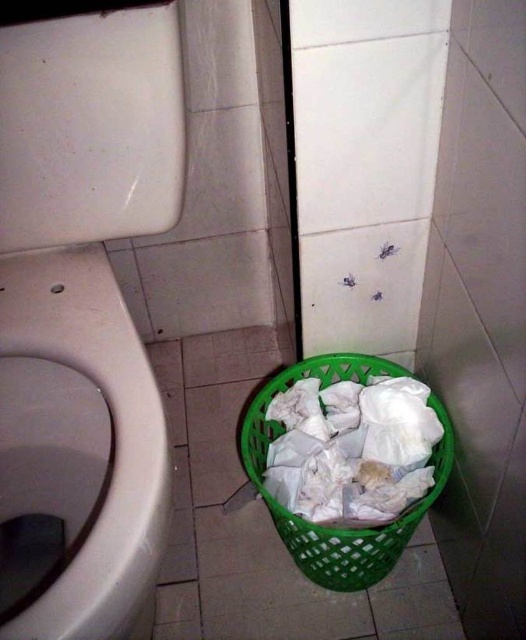
You are standing in the bathroom and need to locate the white glossy toilet bowl at left. According to the scene description, where should you look relative to the green plastic laundry basket?

The white glossy toilet bowl at left is positioned at point [80,440], which means it is located to the left side of the green plastic laundry basket.

You are a bathroom cleaner. You need to determine which object, the white glossy toilet bowl at left or the green plastic basket at lower center, is wider so you can decide which one to move first to clean the area. Which object is wider?

The green plastic basket at lower center is wider than the white glossy toilet bowl at left.

You are a cleaning robot with a width of 12 inches. You are currently positioned near the white glossy toilet bowl at left and need to move to the green plastic basket at lower center. Can you fit through the space between them without touching either?

The distance between the white glossy toilet bowl at left and the green plastic basket at lower center is 11.13 inches. Since your width is 12 inches, which is larger than the available space, you cannot fit through the space between them without touching either.